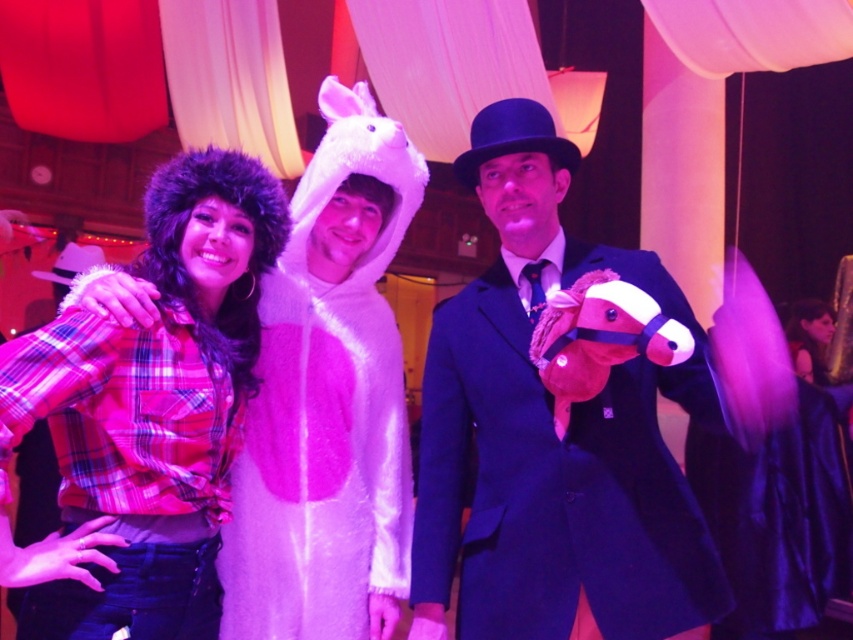
Who is shorter, velvet blue suit at center or plaid flannel shirt at left?

Standing shorter between the two is plaid flannel shirt at left.

Between point (440, 358) and point (186, 522), which one is positioned behind?

Point (440, 358)

Identify the location of velvet blue suit at center. The height and width of the screenshot is (640, 853). (552, 435).